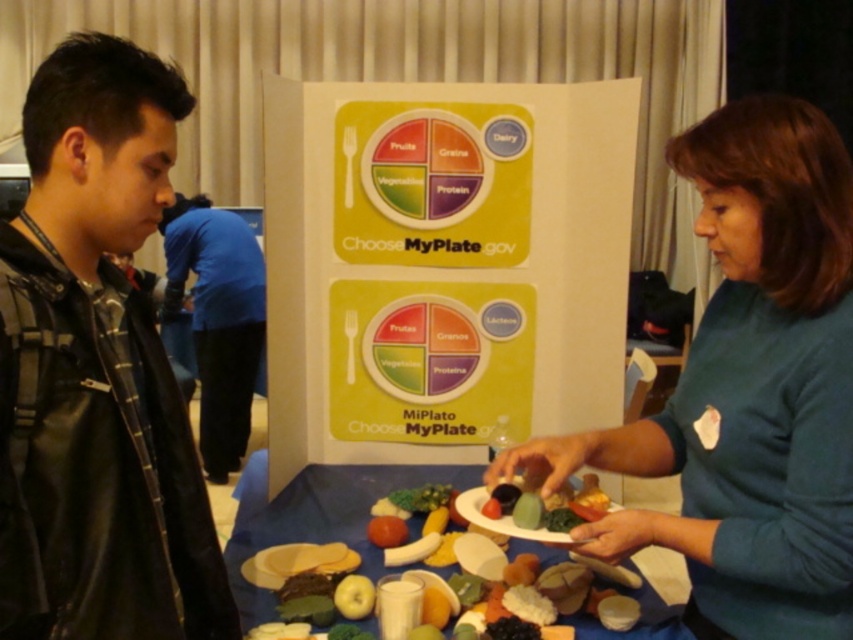
You are a student standing in front of the MyPlate display. You see a point marked at coordinates (747,392). Which object is this point located on?

The point at coordinates (747,392) is located on the teal fabric shirt at center.

You are a teacher preparing a MyPlate activity. You have a teal fabric shirt at center and a blue fabric pants at left on your table. If you want to use the thinner fabric item to demonstrate a food group, which one should you choose?

The teal fabric shirt at center is thinner than the blue fabric pants at left, so you should choose the teal fabric shirt at center to demonstrate the food group.

You are a photographer standing in front of the MyPlate display. You want to take a photo of the black leather jacket at left and the camera. How far apart are these two items?

The black leather jacket at left and the camera are 85.64 centimeters apart.